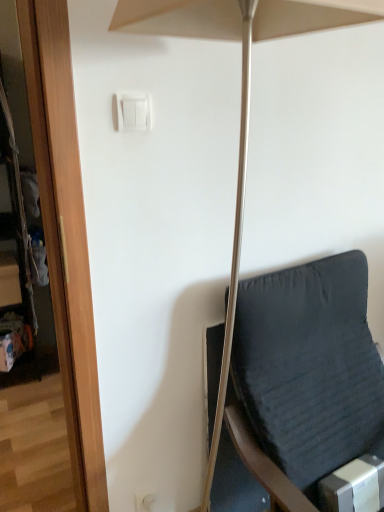
Question: Is matte beige umbrella at center next to dark fabric chair at right?

Choices:
 (A) yes
 (B) no

Answer: (B)

Question: Does matte beige umbrella at center have a greater height compared to dark fabric chair at right?

Choices:
 (A) yes
 (B) no

Answer: (A)

Question: Considering the relative positions of matte beige umbrella at center and dark fabric chair at right in the image provided, is matte beige umbrella at center to the left of dark fabric chair at right from the viewer's perspective?

Choices:
 (A) yes
 (B) no

Answer: (A)

Question: Does matte beige umbrella at center have a smaller size compared to dark fabric chair at right?

Choices:
 (A) no
 (B) yes

Answer: (B)

Question: Is matte beige umbrella at center at the right side of dark fabric chair at right?

Choices:
 (A) yes
 (B) no

Answer: (B)

Question: Does matte beige umbrella at center lie in front of dark fabric chair at right?

Choices:
 (A) yes
 (B) no

Answer: (A)

Question: Does white plastic light switch at upper center come behind matte beige umbrella at center?

Choices:
 (A) no
 (B) yes

Answer: (B)

Question: Considering the relative sizes of white plastic light switch at upper center and matte beige umbrella at center in the image provided, is white plastic light switch at upper center smaller than matte beige umbrella at center?

Choices:
 (A) no
 (B) yes

Answer: (B)

Question: Is white plastic light switch at upper center at the right side of matte beige umbrella at center?

Choices:
 (A) no
 (B) yes

Answer: (A)

Question: From the image's perspective, is white plastic light switch at upper center below matte beige umbrella at center?

Choices:
 (A) no
 (B) yes

Answer: (A)

Question: Is white plastic light switch at upper center shorter than matte beige umbrella at center?

Choices:
 (A) no
 (B) yes

Answer: (B)

Question: Considering the relative sizes of white plastic light switch at upper center and matte beige umbrella at center in the image provided, is white plastic light switch at upper center wider than matte beige umbrella at center?

Choices:
 (A) no
 (B) yes

Answer: (A)

Question: Considering the relative sizes of white plastic light switch at upper center and dark fabric chair at right in the image provided, is white plastic light switch at upper center shorter than dark fabric chair at right?

Choices:
 (A) yes
 (B) no

Answer: (A)